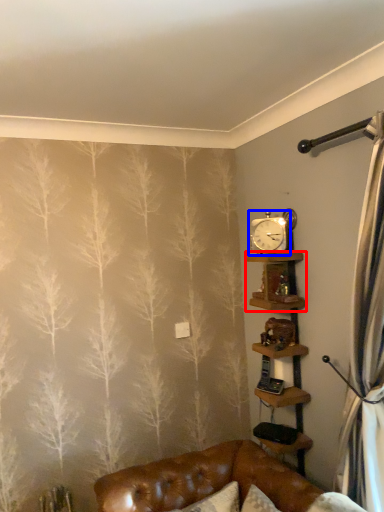
Question: Among these objects, which one is farthest to the camera, shelf (highlighted by a red box) or clock (highlighted by a blue box)?

Choices:
 (A) shelf
 (B) clock

Answer: (B)